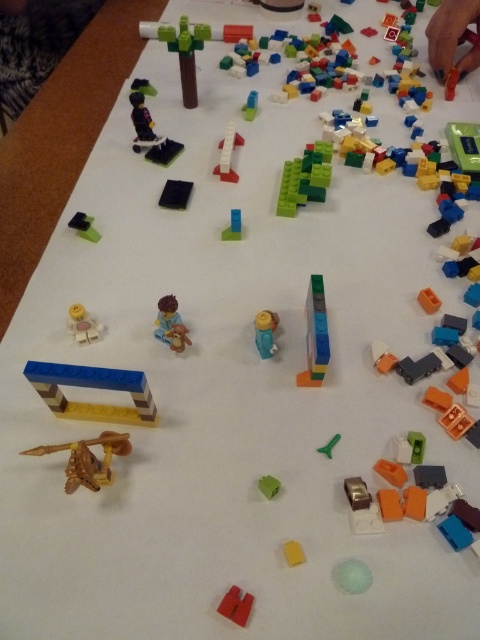
Who is positioned more to the right, matte plastic hand at upper right or blue matte block at center?

matte plastic hand at upper right

Is matte plastic hand at upper right above blue matte block at center?

Indeed, matte plastic hand at upper right is positioned over blue matte block at center.

Where is `matte plastic hand at upper right`? This screenshot has height=640, width=480. matte plastic hand at upper right is located at coordinates (453, 36).

What do you see at coordinates (83, 324) in the screenshot? The height and width of the screenshot is (640, 480). I see `yellow matte minifigure at lower left` at bounding box center [83, 324].

Which is more to the right, yellow matte minifigure at lower left or blue matte block at center?

blue matte block at center

The height and width of the screenshot is (640, 480). Describe the element at coordinates (83, 324) in the screenshot. I see `yellow matte minifigure at lower left` at that location.

Where is `yellow matte minifigure at lower left`? yellow matte minifigure at lower left is located at coordinates (83, 324).

This screenshot has width=480, height=640. I want to click on light blue plastic figure at center, so click(167, 317).

Does point (162, 337) come farther from viewer compared to point (186, 342)?

Yes, it is behind point (186, 342).

The width and height of the screenshot is (480, 640). I want to click on light blue plastic figure at center, so click(167, 317).

I want to click on light blue plastic figure at center, so click(167, 317).